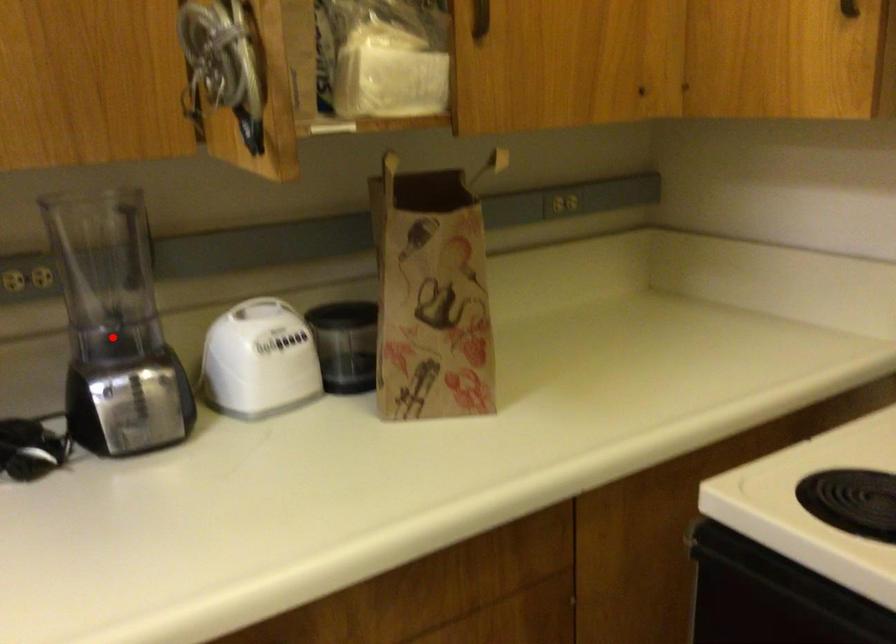
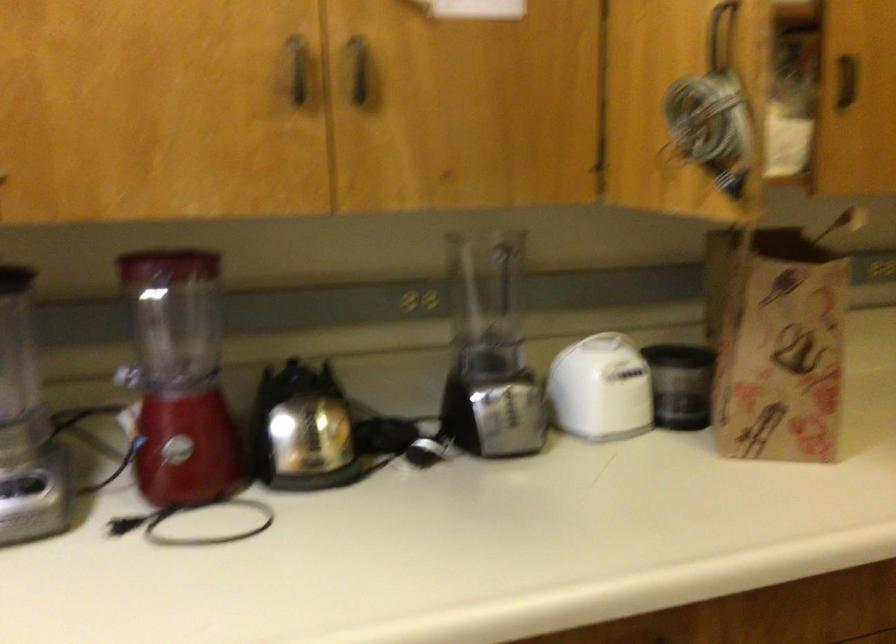
Question: I am providing you with two images of the same scene from different viewpoints. In image1, a red point is highlighted. Considering the same 3D point in image2, which of the following is correct?

Choices:
 (A) It is closer
 (B) It is farther

Answer: (B)